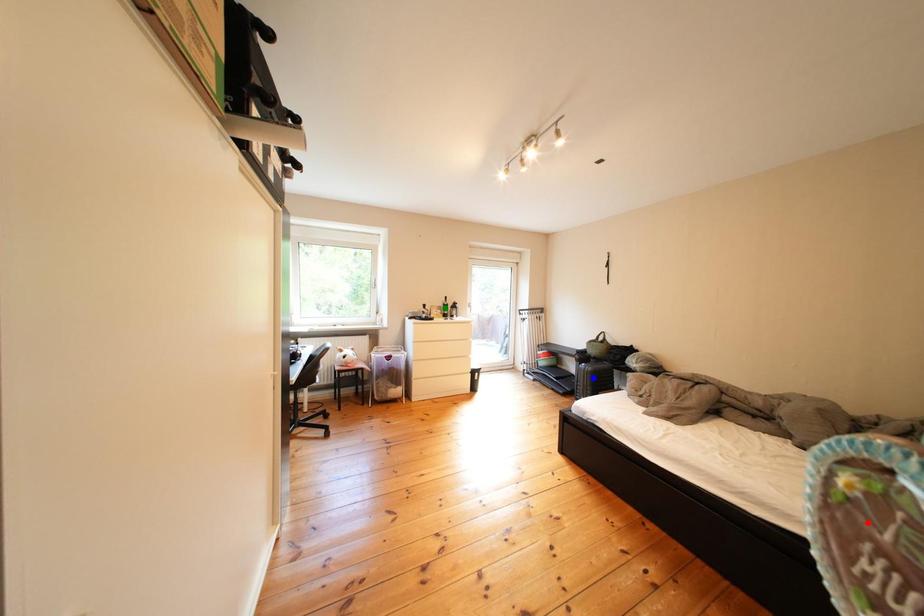
Order these from farthest to nearest:
1. red point
2. blue point
3. green point

blue point, green point, red point